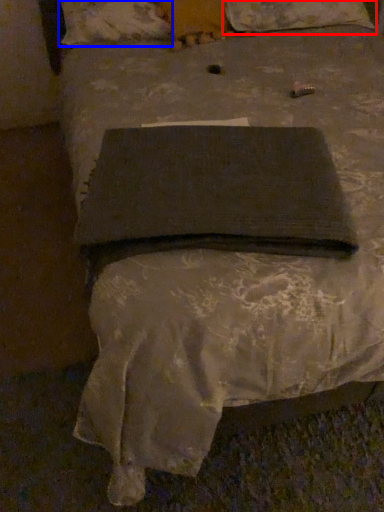
Question: Which of the following is the farthest to the observer, pillow (highlighted by a red box) or pillow (highlighted by a blue box)?

Choices:
 (A) pillow
 (B) pillow

Answer: (A)